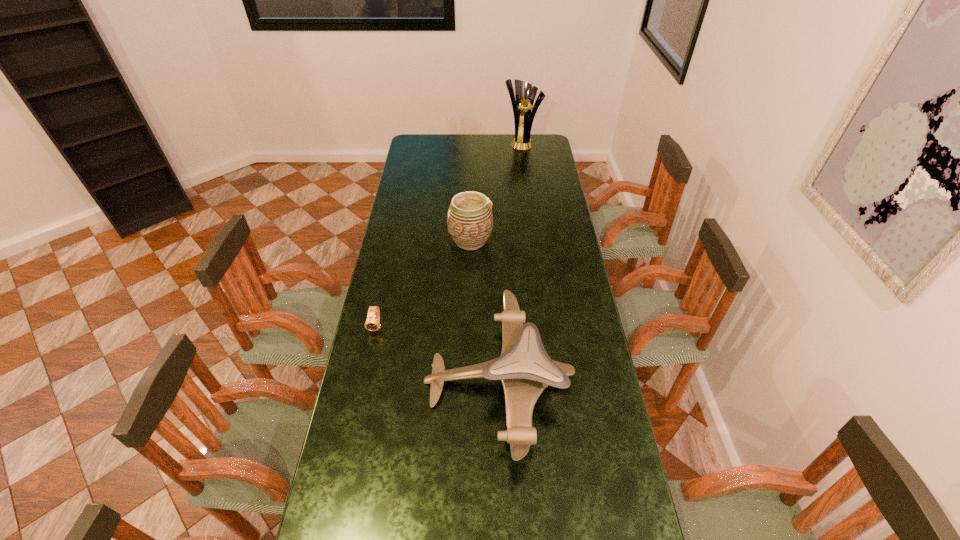
Locate an element on the screen. The height and width of the screenshot is (540, 960). the farthest object is located at coordinates (525, 93).

At what (x,y) coordinates should I click in order to perform the action: click on award. Please return your answer as a coordinate pair (x, y). Image resolution: width=960 pixels, height=540 pixels. Looking at the image, I should click on (525, 93).

I want to click on the third shortest object, so click(x=469, y=220).

In order to click on the third nearest object in this screenshot , I will do `click(469, 220)`.

Find the location of a particular element. Image resolution: width=960 pixels, height=540 pixels. the second shortest object is located at coordinates (525, 369).

At what (x,y) coordinates should I click in order to perform the action: click on the leftmost object. Please return your answer as a coordinate pair (x, y). Looking at the image, I should click on (372, 323).

Find the location of a particular element. The image size is (960, 540). watch is located at coordinates (372, 323).

Image resolution: width=960 pixels, height=540 pixels. Identify the location of vacant space positioned 0.180m at the front of the tallest object, where the globe is visible. (525, 167).

At what (x,y) coordinates should I click in order to perform the action: click on vacant area located 0.090m on the right of the third shortest object. Please return your answer as a coordinate pair (x, y). The image size is (960, 540). Looking at the image, I should click on (514, 241).

This screenshot has height=540, width=960. I want to click on vacant position located 0.140m on the front-facing side of the second shortest object, so click(380, 381).